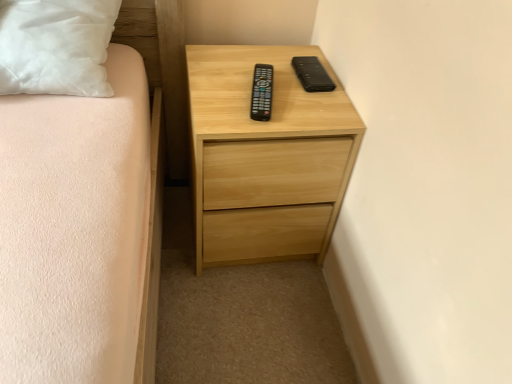
Question: From their relative heights in the image, would you say natural wood chest of drawers at center is taller or shorter than black matte case at upper right?

Choices:
 (A) short
 (B) tall

Answer: (B)

Question: Considering the positions of natural wood chest of drawers at center and black matte case at upper right in the image, is natural wood chest of drawers at center bigger or smaller than black matte case at upper right?

Choices:
 (A) small
 (B) big

Answer: (B)

Question: Which object is positioned farthest from the black matte case at upper right?

Choices:
 (A) natural wood chest of drawers at center
 (B) black plastic remote at center

Answer: (A)

Question: Estimate the real-world distances between objects in this image. Which object is farther from the black plastic remote at center?

Choices:
 (A) natural wood chest of drawers at center
 (B) black matte case at upper right

Answer: (A)